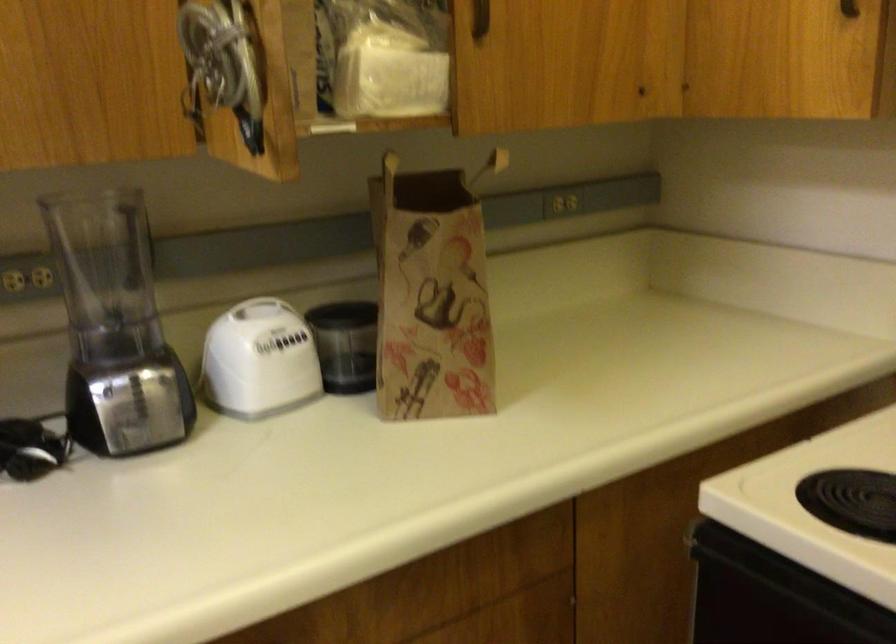
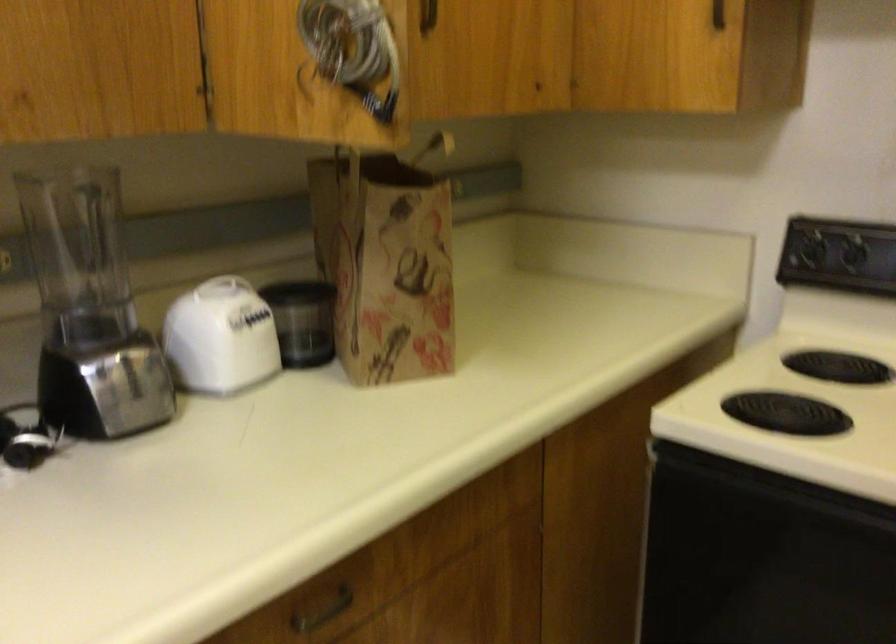
Question: What movement of the cameraman would produce the second image?

Choices:
 (A) Left
 (B) Right
 (C) Forward
 (D) Backward

Answer: (A)